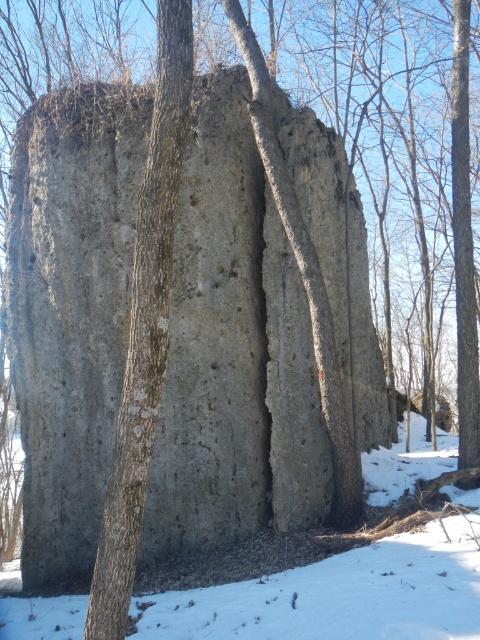
Question: Is gray rough rock at center thinner than white powdery snow at lower center?

Choices:
 (A) yes
 (B) no

Answer: (A)

Question: Which object is positioned closest to the gray rough rock at center?

Choices:
 (A) smooth gray bark at center
 (B) white powdery snow at lower center

Answer: (B)

Question: Considering the relative positions of white powdery snow at lower center and smooth gray bark at center in the image provided, where is white powdery snow at lower center located with respect to smooth gray bark at center?

Choices:
 (A) below
 (B) above

Answer: (A)

Question: Does gray rough rock at center appear over smooth gray bark at center?

Choices:
 (A) yes
 (B) no

Answer: (B)

Question: Which point is farther to the camera?

Choices:
 (A) [x=87, y=355]
 (B) [x=145, y=481]
 (C) [x=346, y=586]

Answer: (A)

Question: Which point is farther from the camera taking this photo?

Choices:
 (A) (84, 460)
 (B) (434, 522)

Answer: (A)